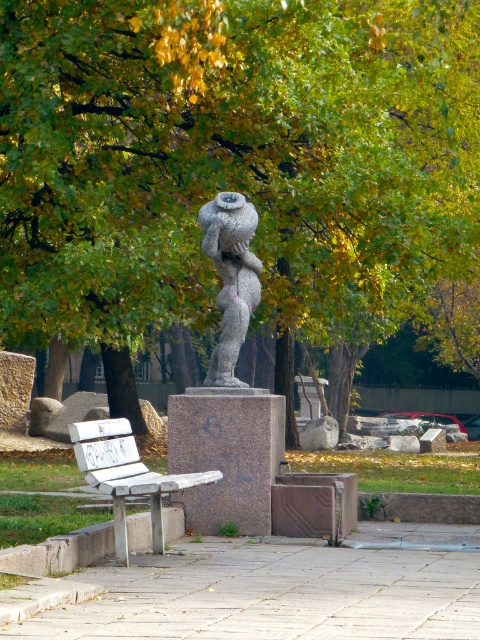
Is green leafy tree at upper center above granite statue at center?

Yes, green leafy tree at upper center is above granite statue at center.

What do you see at coordinates (233, 156) in the screenshot? The height and width of the screenshot is (640, 480). I see `green leafy tree at upper center` at bounding box center [233, 156].

Where is `green leafy tree at upper center`? The image size is (480, 640). green leafy tree at upper center is located at coordinates (233, 156).

Is granite statue at center wider than white wood bench at lower left?

Incorrect, granite statue at center's width does not surpass white wood bench at lower left's.

Which is in front, point (253, 285) or point (87, 435)?

Point (87, 435)

Find the location of a particular element. This screenshot has height=640, width=480. granite statue at center is located at coordinates (230, 276).

Which is above, green leafy tree at upper center or white wood bench at lower left?

Positioned higher is green leafy tree at upper center.

Does green leafy tree at upper center have a greater width compared to white wood bench at lower left?

Yes.

The height and width of the screenshot is (640, 480). What do you see at coordinates (233, 156) in the screenshot? I see `green leafy tree at upper center` at bounding box center [233, 156].

Locate an element on the screen. The height and width of the screenshot is (640, 480). green leafy tree at upper center is located at coordinates (233, 156).